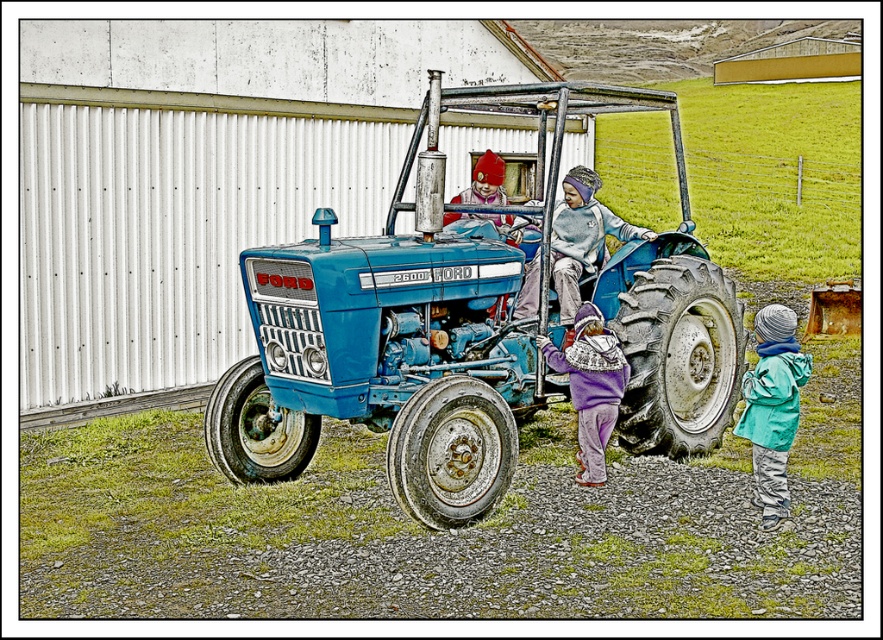
Which is more to the left, teal fabric jacket at lower right or purple fleece jacket at center?

From the viewer's perspective, purple fleece jacket at center appears more on the left side.

Between point (737, 432) and point (580, 388), which one is positioned behind?

Positioned behind is point (580, 388).

The width and height of the screenshot is (883, 640). In order to click on teal fabric jacket at lower right in this screenshot , I will do `click(772, 406)`.

Does blue metallic tractor at center have a lesser width compared to teal fabric jacket at lower right?

Incorrect, blue metallic tractor at center's width is not less than teal fabric jacket at lower right's.

Is the position of blue metallic tractor at center less distant than that of teal fabric jacket at lower right?

No, blue metallic tractor at center is behind teal fabric jacket at lower right.

Does point (254, 308) lie in front of point (756, 490)?

That is False.

You are a GUI agent. You are given a task and a screenshot of the screen. Output one action in this format:
    pyautogui.click(x=<x>, y=<y>)
    Task: Click on the blue metallic tractor at center
    Image resolution: width=883 pixels, height=640 pixels.
    Given the screenshot: What is the action you would take?
    [x=464, y=333]

Does point (776, 410) come behind point (570, 228)?

No.

Consider the image. Between teal fabric jacket at lower right and light blue fleece jacket at center, which one has more height?

Standing taller between the two is teal fabric jacket at lower right.

You are a GUI agent. You are given a task and a screenshot of the screen. Output one action in this format:
    pyautogui.click(x=<x>, y=<y>)
    Task: Click on the teal fabric jacket at lower right
    This screenshot has width=883, height=640.
    Given the screenshot: What is the action you would take?
    pyautogui.click(x=772, y=406)